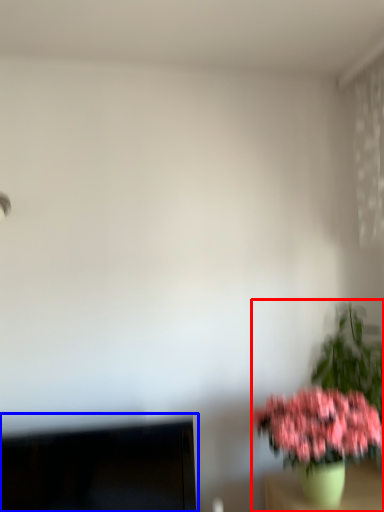
Question: Which object is closer to the camera taking this photo, houseplant (highlighted by a red box) or computer monitor (highlighted by a blue box)?

Choices:
 (A) houseplant
 (B) computer monitor

Answer: (A)